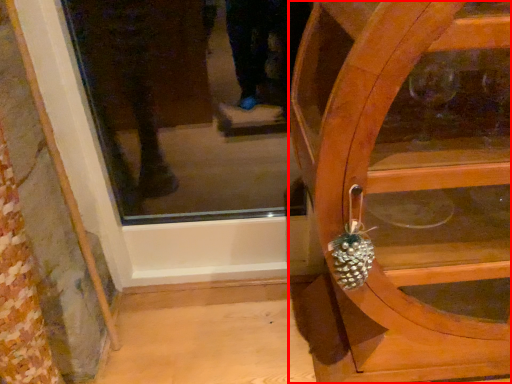
Question: From the image, what is the correct spatial relationship of furniture (annotated by the red box) in relation to pineapple?

Choices:
 (A) right
 (B) left

Answer: (A)